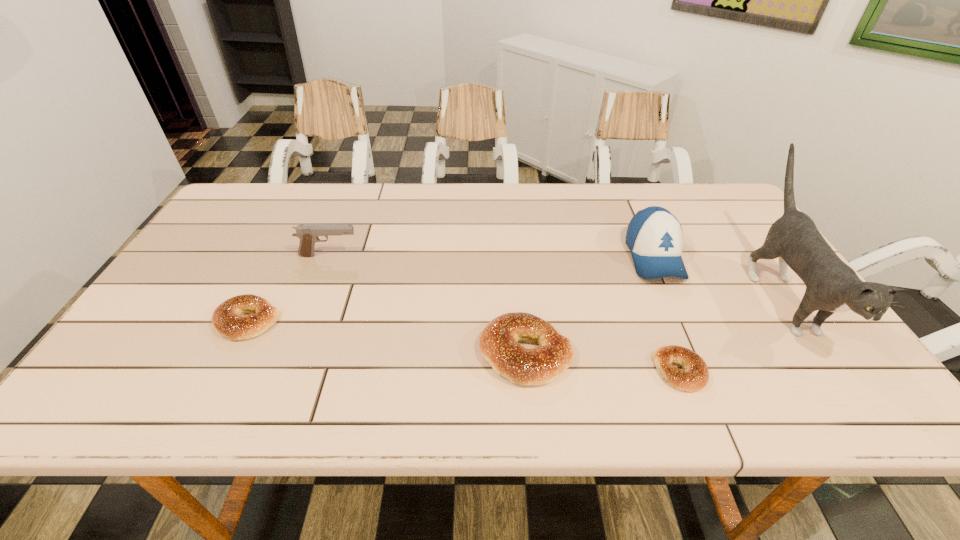
Where is `free space that is in between the third object from left to right and the rightmost bagel`? free space that is in between the third object from left to right and the rightmost bagel is located at coordinates (603, 362).

Locate an element on the screen. The image size is (960, 540). free spot between the rightmost object and the tallest bagel is located at coordinates (654, 325).

Find the location of a particular element. This screenshot has height=540, width=960. vacant area that lies between the fifth tallest object and the fourth shortest object is located at coordinates click(x=288, y=288).

I want to click on free space between the second tallest object and the shortest object, so click(x=667, y=314).

Find the location of a particular element. The height and width of the screenshot is (540, 960). object that can be found as the second closest to the pistol is located at coordinates click(498, 341).

Locate an element on the screen. the fourth closest object relative to the rightmost bagel is located at coordinates (308, 234).

Locate an element on the screen. Image resolution: width=960 pixels, height=540 pixels. bagel that stands as the third closest to the rightmost object is located at coordinates (226, 318).

Select which bagel appears as the closest to the second bagel from right to left. Please provide its 2D coordinates. Your answer should be formatted as a tuple, i.e. [(x, y)], where the tuple contains the x and y coordinates of a point satisfying the conditions above.

[(695, 376)]

You are a GUI agent. You are given a task and a screenshot of the screen. Output one action in this format:
    pyautogui.click(x=<x>, y=<y>)
    Task: Click on the free space that satisfies the following two spatial constraints: 1. at the barrel of the pistol; 2. on the right side of the shortest bagel
    
    Given the screenshot: What is the action you would take?
    pyautogui.click(x=285, y=371)

Image resolution: width=960 pixels, height=540 pixels. I want to click on vacant space that satisfies the following two spatial constraints: 1. at the barrel of the third tallest object; 2. on the back side of the fourth tallest object, so click(292, 353).